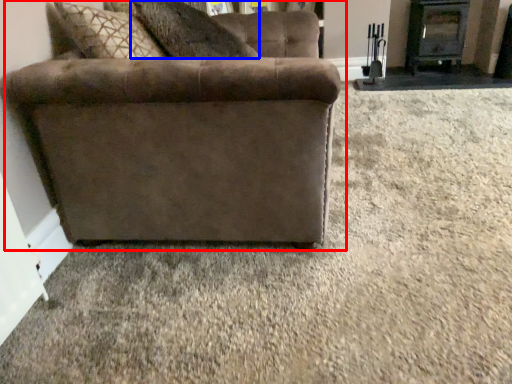
Question: Which point is closer to the camera, studio couch (highlighted by a red box) or pillow (highlighted by a blue box)?

Choices:
 (A) studio couch
 (B) pillow

Answer: (A)